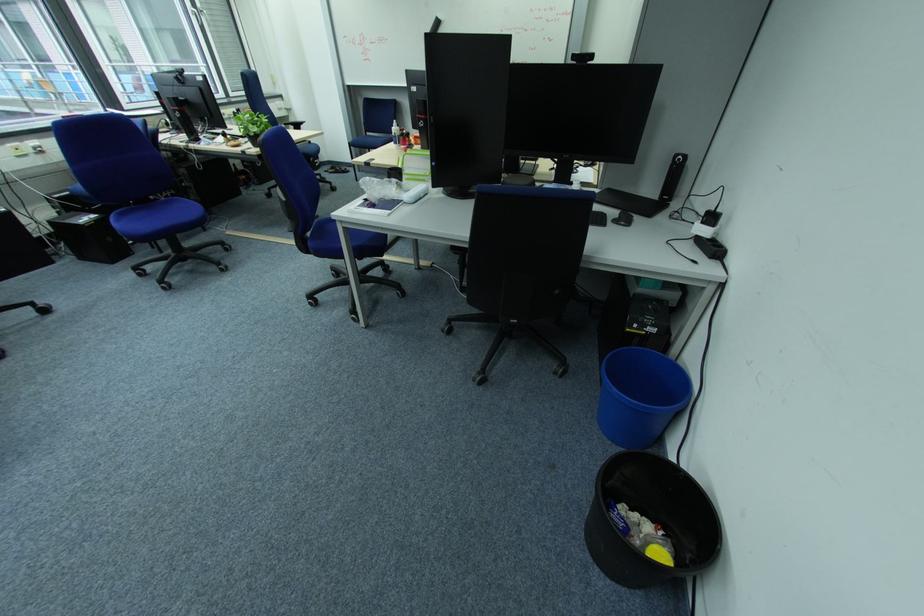
What are the coordinates of `black computer mouse` in the screenshot? It's located at (623, 217).